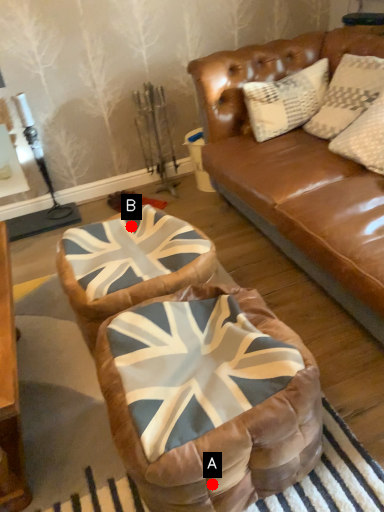
Question: Two points are circled on the image, labeled by A and B beside each circle. Among these points, which one is nearest to the camera?

Choices:
 (A) A is closer
 (B) B is closer

Answer: (A)